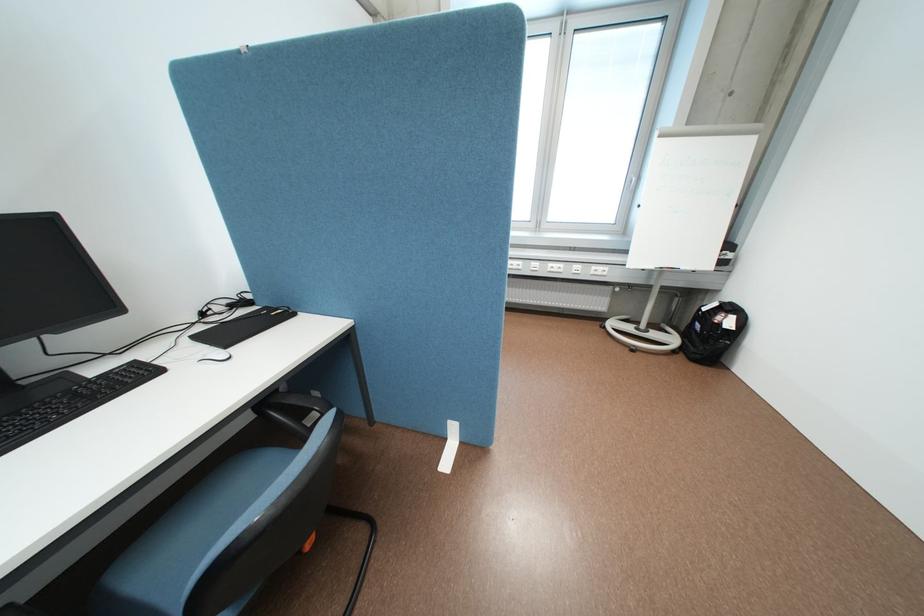
This screenshot has width=924, height=616. In order to click on orange adjustment lever in this screenshot , I will do `click(308, 543)`.